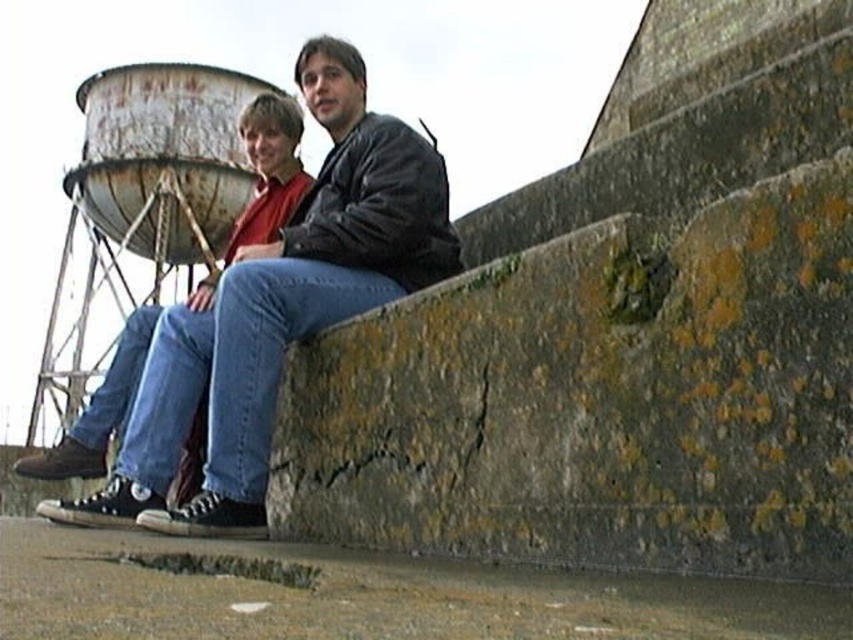
Who is more distant from viewer, (258, 404) or (142, 67)?

The point (142, 67) is behind.

Is denim jeans at center taller than rusty metal water tower at upper left?

No.

You are a GUI agent. You are given a task and a screenshot of the screen. Output one action in this format:
    pyautogui.click(x=<x>, y=<y>)
    Task: Click on the denim jeans at center
    The height and width of the screenshot is (640, 853).
    Given the screenshot: What is the action you would take?
    (277, 310)